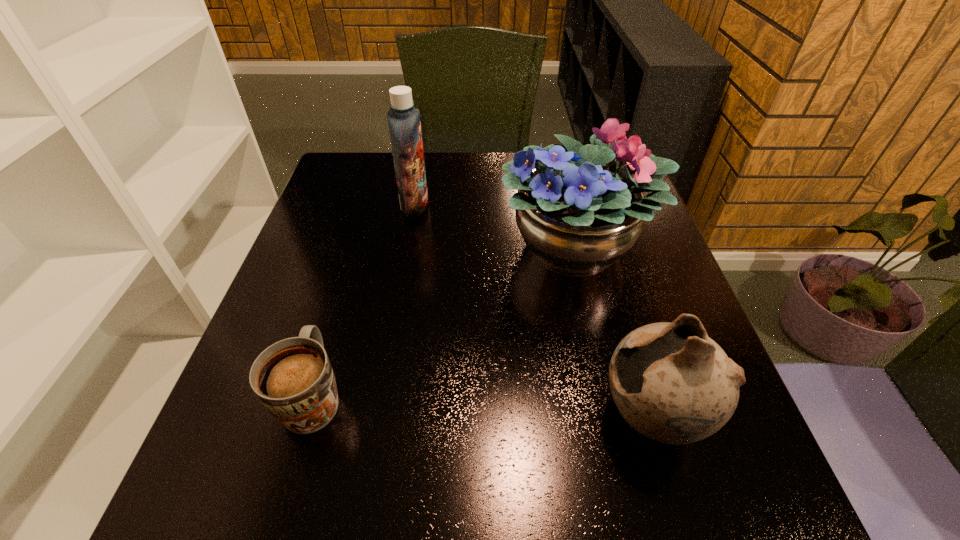
What are the coordinates of `vacant region between the bouquet and the third tallest object` in the screenshot? It's located at (614, 331).

At what (x,y) coordinates should I click in order to perform the action: click on vacant area that lies between the mug and the bouquet. Please return your answer as a coordinate pair (x, y). The width and height of the screenshot is (960, 540). Looking at the image, I should click on (445, 321).

Image resolution: width=960 pixels, height=540 pixels. I want to click on vacant area that lies between the third object from right to left and the pottery, so (533, 310).

Locate which object is the closest to the leftmost object. Please provide its 2D coordinates. Your answer should be formatted as a tuple, i.e. [(x, y)], where the tuple contains the x and y coordinates of a point satisfying the conditions above.

[(577, 216)]

Identify which object is the second nearest to the bouquet. Please provide its 2D coordinates. Your answer should be formatted as a tuple, i.e. [(x, y)], where the tuple contains the x and y coordinates of a point satisfying the conditions above.

[(404, 124)]

Find the location of a particular element. The width and height of the screenshot is (960, 540). free location that satisfies the following two spatial constraints: 1. on the front label of the bouquet; 2. on the left side of the second object from left to right is located at coordinates (407, 246).

Locate an element on the screen. The height and width of the screenshot is (540, 960). free location that satisfies the following two spatial constraints: 1. on the front label of the bouquet; 2. on the right side of the shampoo is located at coordinates (407, 246).

Locate an element on the screen. vacant area that satisfies the following two spatial constraints: 1. on the front label of the shampoo; 2. on the left side of the bouquet is located at coordinates (407, 246).

Locate an element on the screen. The image size is (960, 540). free spot that satisfies the following two spatial constraints: 1. on the front label of the shampoo; 2. on the right side of the bouquet is located at coordinates (407, 246).

At what (x,y) coordinates should I click in order to perform the action: click on free space that satisfies the following two spatial constraints: 1. on the front label of the third object from right to left; 2. on the left side of the bouquet. Please return your answer as a coordinate pair (x, y). Looking at the image, I should click on (407, 246).